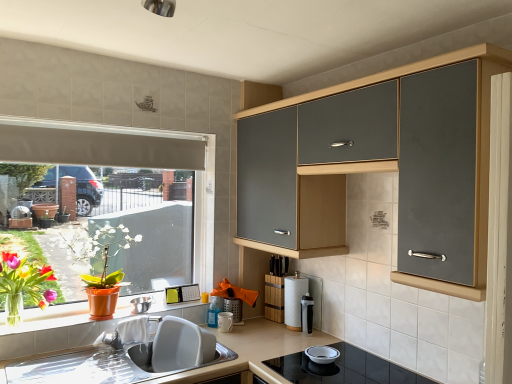
In the scene shown: What is the approximate height of translucent plastic bottle at upper center, which appears as the 2th appliance when viewed from the left?

3.72 inches.

Locate an element on the screen. This screenshot has width=512, height=384. beige matte countertop at lower center is located at coordinates (217, 362).

Describe the element at coordinates (63, 324) in the screenshot. The width and height of the screenshot is (512, 384). I see `orange plastic at lower left` at that location.

Measure the distance between matte gray cabinet at upper right and camera.

3.53 feet.

Locate an element on the screen. The height and width of the screenshot is (384, 512). metallic stainless steel bowl at upper left, the first appliance positioned from the left is located at coordinates (141, 304).

Image resolution: width=512 pixels, height=384 pixels. In order to click on vivid floral bouquet at left in this screenshot , I will do `click(29, 245)`.

What are the coordinates of `sink in front of the metallic stainless steel bowl at upper left, the first appliance positioned from the left` in the screenshot? It's located at (168, 346).

Which object is positioned more to the left, metallic stainless steel bowl at upper left, the first appliance positioned from the left, or white plastic sink at lower left?

metallic stainless steel bowl at upper left, the first appliance positioned from the left, is more to the left.

Looking at this image, which is correct: metallic stainless steel bowl at upper left, the first appliance positioned from the left, is inside white plastic sink at lower left, or outside of it?

metallic stainless steel bowl at upper left, the first appliance positioned from the left, is not enclosed by white plastic sink at lower left.

From the image's perspective, relative to white plastic sink at lower left, is metallic stainless steel bowl at upper left, which is the sixth appliance from right to left, above or below?

From the image's perspective, metallic stainless steel bowl at upper left, which is the sixth appliance from right to left, appears above white plastic sink at lower left.

From the image's perspective, which appliance is the 1st one above the beige matte countertop at lower center? Please provide its 2D coordinates.

[(225, 322)]

Does white ceramic mug at lower center, placed as the 3th appliance when sorted from left to right, have a lesser width compared to beige matte countertop at lower center?

Indeed, white ceramic mug at lower center, placed as the 3th appliance when sorted from left to right, has a lesser width compared to beige matte countertop at lower center.

Consider the image. Is white ceramic mug at lower center, placed as the 3th appliance when sorted from left to right, to the left of beige matte countertop at lower center from the viewer's perspective?

Indeed, white ceramic mug at lower center, placed as the 3th appliance when sorted from left to right, is positioned on the left side of beige matte countertop at lower center.

From a real-world perspective, which object rests below the other?

In real-world perspective, beige matte countertop at lower center is lower.

From the image's perspective, which is below, translucent plastic bottle at upper center, which appears as the 2th appliance when viewed from the left, or black plastic water bottle at upper right, which is the 6th appliance in left-to-right order?

translucent plastic bottle at upper center, which appears as the 2th appliance when viewed from the left, is shown below in the image.

From a real-world perspective, relative to black plastic water bottle at upper right, which is the 6th appliance in left-to-right order, is translucent plastic bottle at upper center, positioned as the 5th appliance in right-to-left order, vertically above or below?

translucent plastic bottle at upper center, positioned as the 5th appliance in right-to-left order, is below black plastic water bottle at upper right, which is the 6th appliance in left-to-right order.

Could you tell me if translucent plastic bottle at upper center, which appears as the 2th appliance when viewed from the left, is turned towards black plastic water bottle at upper right, the first appliance viewed from the right?

No.

Is translucent plastic bottle at upper center, positioned as the 5th appliance in right-to-left order, wider than black plastic water bottle at upper right, which is the 6th appliance in left-to-right order?

Yes, translucent plastic bottle at upper center, positioned as the 5th appliance in right-to-left order, is wider than black plastic water bottle at upper right, which is the 6th appliance in left-to-right order.

Where is `window sill in front of the white ceramic mug at lower center, placed as the 3th appliance when sorted from left to right`? window sill in front of the white ceramic mug at lower center, placed as the 3th appliance when sorted from left to right is located at coordinates (63, 324).

Would you say orange plastic at lower left contains white ceramic mug at lower center, placed as the 3th appliance when sorted from left to right?

No, white ceramic mug at lower center, placed as the 3th appliance when sorted from left to right, is not surrounded by orange plastic at lower left.

Considering the positions of objects orange plastic at lower left and white ceramic mug at lower center, placed as the fourth appliance when sorted from right to left, in the image provided, who is more to the right, orange plastic at lower left or white ceramic mug at lower center, placed as the fourth appliance when sorted from right to left,?

white ceramic mug at lower center, placed as the fourth appliance when sorted from right to left, is more to the right.

Can you tell me how much orange plastic at lower left and white ceramic mug at lower center, placed as the 3th appliance when sorted from left to right, differ in facing direction?

1.71 degrees separate the facing orientations of orange plastic at lower left and white ceramic mug at lower center, placed as the 3th appliance when sorted from left to right.

Is translucent plastic bottle at upper center, positioned as the 5th appliance in right-to-left order, not near metallic mesh container at center, which is the 4th appliance from left to right?

No, translucent plastic bottle at upper center, positioned as the 5th appliance in right-to-left order, is in close proximity to metallic mesh container at center, which is the 4th appliance from left to right.

This screenshot has width=512, height=384. I want to click on appliance that is the 2nd object to the right of the translucent plastic bottle at upper center, which appears as the 2th appliance when viewed from the left, starting at the anchor, so click(233, 308).

Is point (210, 306) closer to viewer compared to point (227, 303)?

Yes, point (210, 306) is closer to viewer.

Looking at their sizes, would you say translucent plastic bottle at upper center, positioned as the 5th appliance in right-to-left order, is wider or thinner than metallic stainless steel bowl at upper left, which is the sixth appliance from right to left?

translucent plastic bottle at upper center, positioned as the 5th appliance in right-to-left order, is thinner than metallic stainless steel bowl at upper left, which is the sixth appliance from right to left.

Looking at this image, is translucent plastic bottle at upper center, positioned as the 5th appliance in right-to-left order, oriented away from metallic stainless steel bowl at upper left, which is the sixth appliance from right to left?

translucent plastic bottle at upper center, positioned as the 5th appliance in right-to-left order, is not turned away from metallic stainless steel bowl at upper left, which is the sixth appliance from right to left.

Would you say translucent plastic bottle at upper center, positioned as the 5th appliance in right-to-left order, is a long distance from metallic stainless steel bowl at upper left, which is the sixth appliance from right to left?

Actually, translucent plastic bottle at upper center, positioned as the 5th appliance in right-to-left order, and metallic stainless steel bowl at upper left, which is the sixth appliance from right to left, are a little close together.

Between point (217, 326) and point (143, 307), which one is positioned behind?

The point (217, 326) is more distant.

Is white ceramic mug at lower center, placed as the 3th appliance when sorted from left to right, not close to translucent plastic bottle at upper center, positioned as the 5th appliance in right-to-left order?

white ceramic mug at lower center, placed as the 3th appliance when sorted from left to right, is near translucent plastic bottle at upper center, positioned as the 5th appliance in right-to-left order, not far away.

Measure the distance between white ceramic mug at lower center, placed as the fourth appliance when sorted from right to left, and translucent plastic bottle at upper center, positioned as the 5th appliance in right-to-left order.

white ceramic mug at lower center, placed as the fourth appliance when sorted from right to left, is 4.96 centimeters away from translucent plastic bottle at upper center, positioned as the 5th appliance in right-to-left order.

From the image's perspective, is white ceramic mug at lower center, placed as the fourth appliance when sorted from right to left, under translucent plastic bottle at upper center, positioned as the 5th appliance in right-to-left order?

Yes, from the image's perspective, white ceramic mug at lower center, placed as the fourth appliance when sorted from right to left, is below translucent plastic bottle at upper center, positioned as the 5th appliance in right-to-left order.

What are the coordinates of `appliance on the left of the white plastic sink at lower left` in the screenshot? It's located at (141, 304).

In the image, there is a white ceramic mug at lower center, placed as the 3th appliance when sorted from left to right. In order to click on countertop below it (from the image's perspective) in this screenshot , I will do `click(217, 362)`.

Consider the image. When comparing their distances from metallic mesh container at center, which appears as the third appliance when viewed from the right, does white ceramic mug at lower center, placed as the fourth appliance when sorted from right to left, or vivid floral bouquet at left seem closer?

white ceramic mug at lower center, placed as the fourth appliance when sorted from right to left, lies closer to metallic mesh container at center, which appears as the third appliance when viewed from the right, than the other object.

Which object lies nearer to the anchor point orange plastic at lower left, matte orange pot at left or matte gray cabinet at upper right?

Among the two, matte orange pot at left is located nearer to orange plastic at lower left.

Estimate the real-world distances between objects in this image. Which object is closer to white plastic sink at lower left, white ceramic mug at lower center, placed as the fourth appliance when sorted from right to left, or white paper towel at center, which is counted as the second appliance, starting from the right?

white ceramic mug at lower center, placed as the fourth appliance when sorted from right to left, is positioned closer to the anchor white plastic sink at lower left.

When comparing their distances from beige matte countertop at lower center, does white plastic sink at lower left or matte gray cabinet at upper right seem closer?

white plastic sink at lower left is positioned closer to the anchor beige matte countertop at lower center.

Based on their spatial positions, is translucent plastic bottle at upper center, positioned as the 5th appliance in right-to-left order, or metallic stainless steel bowl at upper left, which is the sixth appliance from right to left, closer to matte gray cabinet at upper right?

The object closer to matte gray cabinet at upper right is translucent plastic bottle at upper center, positioned as the 5th appliance in right-to-left order.

Considering their positions, is metallic stainless steel bowl at upper left, the first appliance positioned from the left, positioned further to white paper towel at center, the fifth appliance when ordered from left to right, than matte gray cabinet at upper right?

metallic stainless steel bowl at upper left, the first appliance positioned from the left, is positioned further to the anchor white paper towel at center, the fifth appliance when ordered from left to right.

Based on their spatial positions, is orange plastic at lower left or vivid floral bouquet at left closer to white plastic sink at lower left?

orange plastic at lower left is closer to white plastic sink at lower left.

Considering their positions, is matte orange pot at left positioned further to white paper towel at center, which is counted as the second appliance, starting from the right, than translucent plastic bottle at upper center, which appears as the 2th appliance when viewed from the left?

matte orange pot at left is further to white paper towel at center, which is counted as the second appliance, starting from the right.

Identify the location of exhaust hood between vivid floral bouquet at left and matte gray cabinet at upper right. The width and height of the screenshot is (512, 384). (98, 145).

This screenshot has height=384, width=512. Find the location of `houseplant between vivid floral bouquet at left and matte gray cabinet at upper right`. houseplant between vivid floral bouquet at left and matte gray cabinet at upper right is located at coordinates (102, 266).

At what (x,y) coordinates should I click in order to perform the action: click on window sill between matte orange pot at left and white plastic sink at lower left. Please return your answer as a coordinate pair (x, y). The width and height of the screenshot is (512, 384). Looking at the image, I should click on (63, 324).

The image size is (512, 384). Find the location of `window sill between transparent glass window at lower left and black plastic water bottle at upper right, which is the 6th appliance in left-to-right order, in the horizontal direction`. window sill between transparent glass window at lower left and black plastic water bottle at upper right, which is the 6th appliance in left-to-right order, in the horizontal direction is located at coordinates (63, 324).